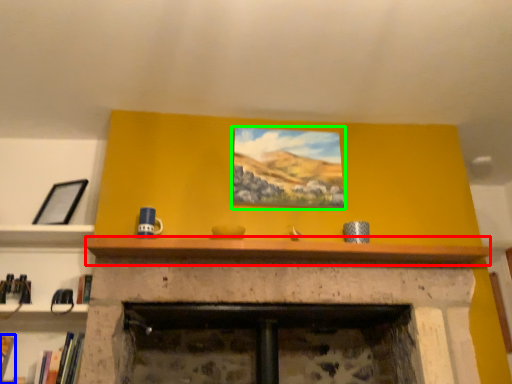
Question: Estimate the real-world distances between objects in this image. Which object is closer to mantle (highlighted by a red box), book (highlighted by a blue box) or picture frame (highlighted by a green box)?

Choices:
 (A) book
 (B) picture frame

Answer: (B)